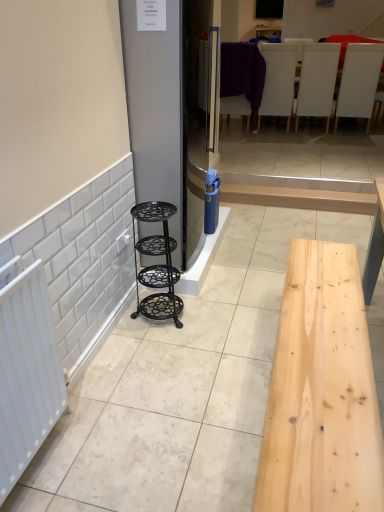
Question: Is the position of purple fabric chair at upper center, the fourth furniture positioned from the right, less distant than that of white matte radiator at left?

Choices:
 (A) yes
 (B) no

Answer: (B)

Question: Can you confirm if purple fabric chair at upper center, the first furniture from the back, is thinner than white matte radiator at left?

Choices:
 (A) yes
 (B) no

Answer: (B)

Question: From a real-world perspective, is purple fabric chair at upper center, the second furniture when ordered from left to right, located beneath white matte radiator at left?

Choices:
 (A) yes
 (B) no

Answer: (B)

Question: Does purple fabric chair at upper center, the first furniture from the back, have a larger size compared to white matte radiator at left?

Choices:
 (A) no
 (B) yes

Answer: (B)

Question: Is purple fabric chair at upper center, the fourth furniture positioned from the right, looking in the opposite direction of white matte radiator at left?

Choices:
 (A) no
 (B) yes

Answer: (B)

Question: Is satin silver fridge at center smaller than white matte chair at upper right, the fourth furniture from the back?

Choices:
 (A) no
 (B) yes

Answer: (A)

Question: Does satin silver fridge at center have a greater width compared to white matte chair at upper right, which ranks as the first furniture in right-to-left order?

Choices:
 (A) no
 (B) yes

Answer: (B)

Question: Does satin silver fridge at center appear on the left side of white matte chair at upper right, the second furniture when ordered from front to back?

Choices:
 (A) yes
 (B) no

Answer: (A)

Question: From a real-world perspective, is satin silver fridge at center located higher than white matte chair at upper right, which is the 5th furniture from left to right?

Choices:
 (A) no
 (B) yes

Answer: (B)

Question: From a real-world perspective, is satin silver fridge at center under white matte chair at upper right, which ranks as the first furniture in right-to-left order?

Choices:
 (A) no
 (B) yes

Answer: (A)

Question: Considering the relative sizes of satin silver fridge at center and white matte chair at upper right, which ranks as the first furniture in right-to-left order, in the image provided, is satin silver fridge at center shorter than white matte chair at upper right, which ranks as the first furniture in right-to-left order,?

Choices:
 (A) yes
 (B) no

Answer: (B)

Question: Can you confirm if white leather chairs at upper center, which is the 3th furniture from left to right, is taller than white matte chair at upper center, the 4th furniture positioned from the left?

Choices:
 (A) no
 (B) yes

Answer: (B)